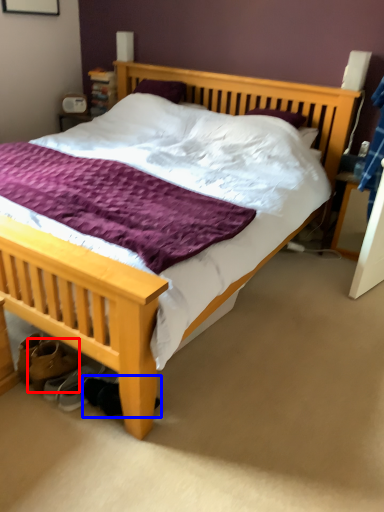
Question: Which point is further to the camera, footwear (highlighted by a red box) or shoe (highlighted by a blue box)?

Choices:
 (A) footwear
 (B) shoe

Answer: (A)